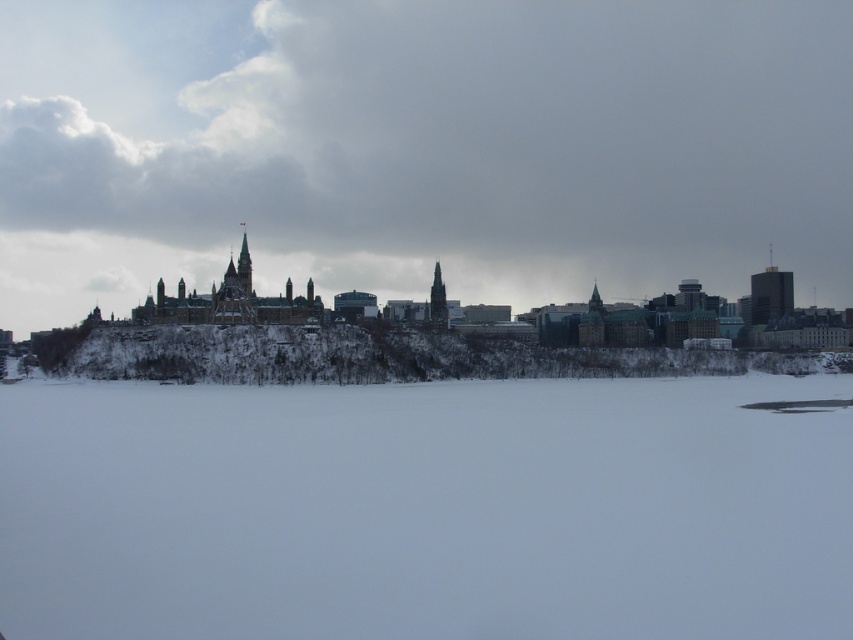
You are standing at the point marked by point (426, 509) in the winter scene. Which direction should you walk to reach the historic building with green roof?

The historic building with green roof is located on the horizon, which is opposite to the direction of the white powdery snow at center marked by point (426, 509). Therefore, you should walk away from the point (426, 509) towards the horizon to reach the historic building with green roof.